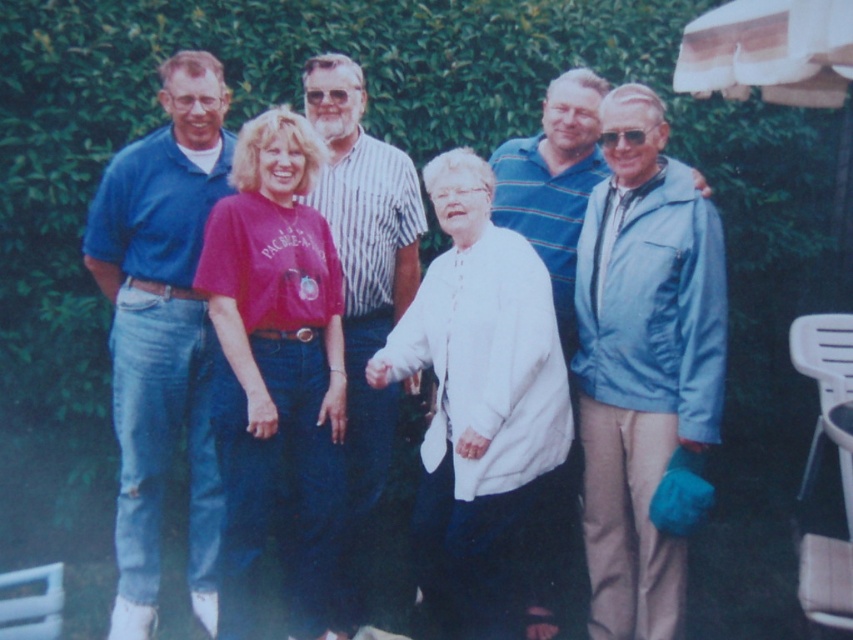
Question: Which point appears closest to the camera in this image?

Choices:
 (A) (508, 221)
 (B) (456, 406)

Answer: (B)

Question: Which is farther from the white cotton shirt at center?

Choices:
 (A) matte red t-shirt at center
 (B) matte blue shirt at center

Answer: (B)

Question: Can you confirm if striped cotton shirt at center is positioned to the right of blue striped shirt at center?

Choices:
 (A) yes
 (B) no

Answer: (B)

Question: Which of the following is the closest to the observer?

Choices:
 (A) striped cotton shirt at center
 (B) matte red t-shirt at center
 (C) blue striped shirt at center
 (D) matte blue polo shirt at left

Answer: (B)

Question: Observing the image, what is the correct spatial positioning of matte red t-shirt at center in reference to matte blue polo shirt at left?

Choices:
 (A) right
 (B) left

Answer: (A)

Question: Is matte blue shirt at center wider than striped cotton shirt at center?

Choices:
 (A) no
 (B) yes

Answer: (B)